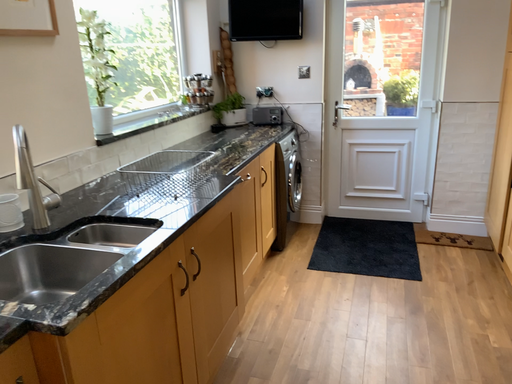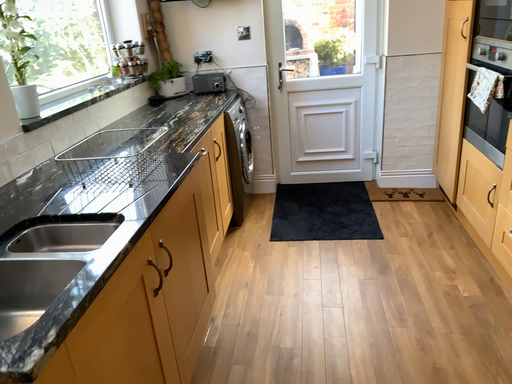
Question: Which way did the camera rotate in the video?

Choices:
 (A) rotated left
 (B) rotated right

Answer: (B)